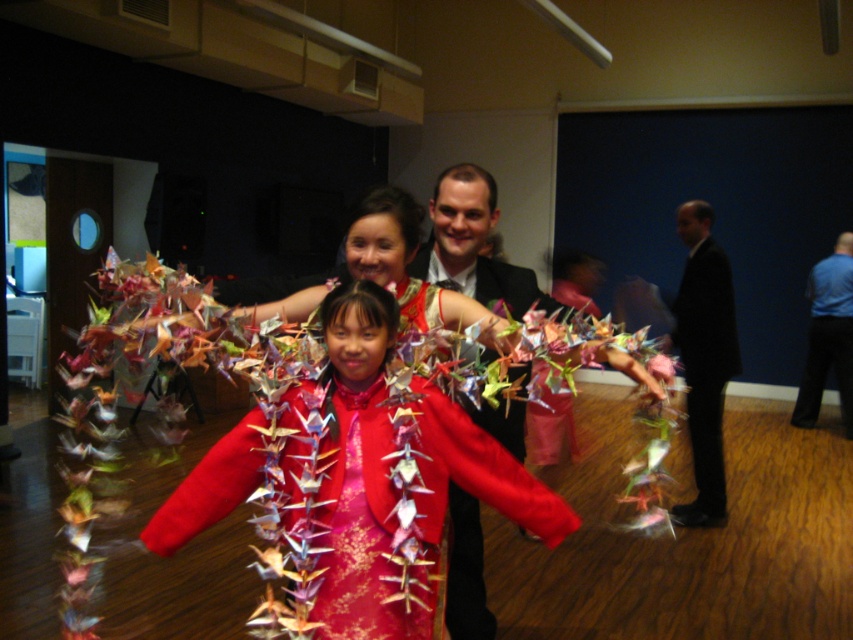
Question: Which object appears closest to the camera in this image?

Choices:
 (A) matte black suit at center
 (B) silky red dress at center

Answer: (B)

Question: Which of the following is the farthest from the observer?

Choices:
 (A) (397, 236)
 (B) (704, 330)
 (C) (467, 536)

Answer: (B)

Question: Considering the real-world distances, which object is closest to the silky red dress at center?

Choices:
 (A) matte black suit at center
 (B) blue smooth shirt at right

Answer: (A)

Question: Can you confirm if silky red dress at center is positioned to the right of black suit at right?

Choices:
 (A) yes
 (B) no

Answer: (B)

Question: Does silky red dress at center lie in front of black suit at right?

Choices:
 (A) yes
 (B) no

Answer: (A)

Question: Does matte black suit at center have a smaller size compared to blue smooth shirt at right?

Choices:
 (A) yes
 (B) no

Answer: (B)